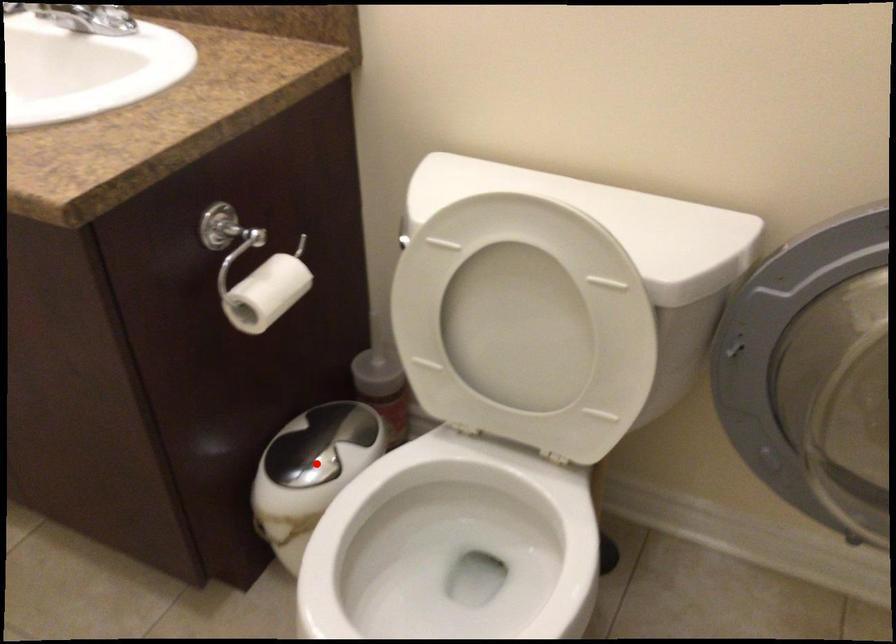
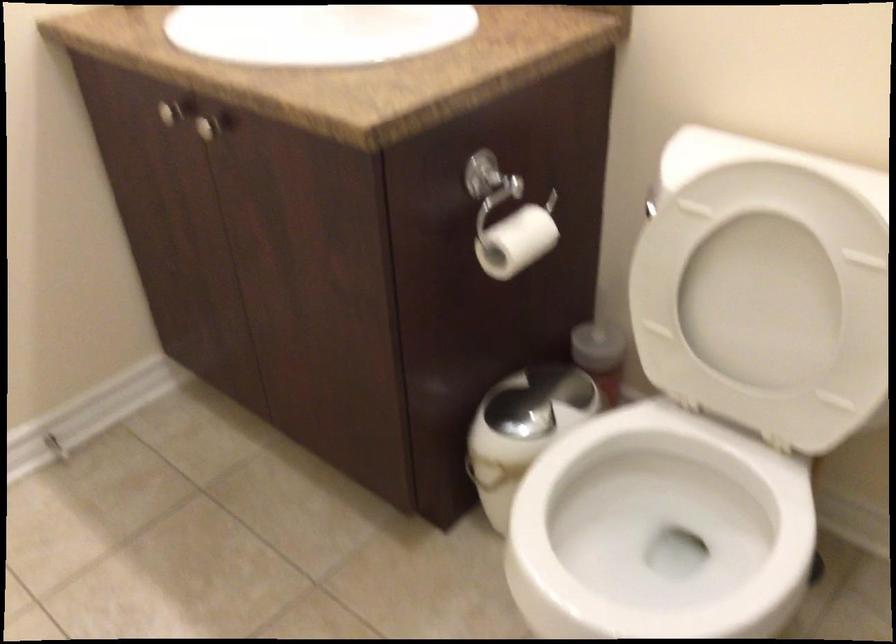
The point at the highlighted location is marked in the first image. Where is the corresponding point in the second image?

(529, 413)